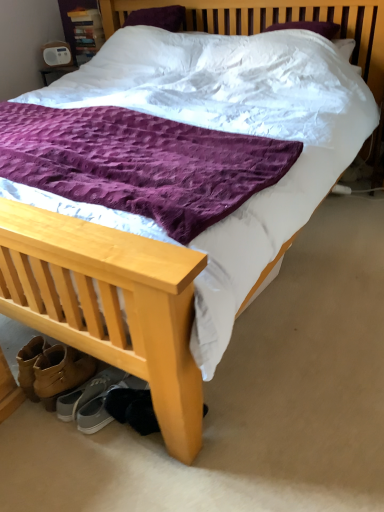
Question: From a real-world perspective, is gray suede sneakers at lower left, which is counted as the first footwear, starting from the left, positioned above or below dark gray suede shoes at lower left, which appears as the first footwear when viewed from the right?

Choices:
 (A) above
 (B) below

Answer: (B)

Question: In the image, is gray suede sneakers at lower left, which is counted as the first footwear, starting from the left, positioned in front of or behind dark gray suede shoes at lower left, placed as the second footwear when sorted from left to right?

Choices:
 (A) behind
 (B) front

Answer: (A)

Question: Visually, is gray suede sneakers at lower left, which appears as the second footwear when viewed from the right, positioned to the left or to the right of dark gray suede shoes at lower left, which appears as the first footwear when viewed from the right?

Choices:
 (A) right
 (B) left

Answer: (B)

Question: Looking at their shapes, would you say dark gray suede shoes at lower left, placed as the second footwear when sorted from left to right, is wider or thinner than gray suede sneakers at lower left, which is counted as the first footwear, starting from the left?

Choices:
 (A) thin
 (B) wide

Answer: (A)

Question: Is dark gray suede shoes at lower left, which appears as the first footwear when viewed from the right, inside the boundaries of gray suede sneakers at lower left, which appears as the second footwear when viewed from the right, or outside?

Choices:
 (A) inside
 (B) outside

Answer: (B)

Question: From a real-world perspective, relative to gray suede sneakers at lower left, which appears as the second footwear when viewed from the right, is dark gray suede shoes at lower left, which appears as the first footwear when viewed from the right, vertically above or below?

Choices:
 (A) below
 (B) above

Answer: (B)

Question: From the image's perspective, is dark gray suede shoes at lower left, which appears as the first footwear when viewed from the right, above or below gray suede sneakers at lower left, which appears as the second footwear when viewed from the right?

Choices:
 (A) above
 (B) below

Answer: (B)